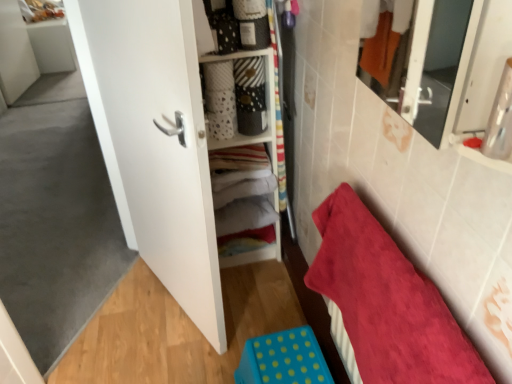
Question: Is red plush towel at lower right aimed at blue polka dot plastic step stool at lower center?

Choices:
 (A) no
 (B) yes

Answer: (B)

Question: Is red plush towel at lower right facing away from blue polka dot plastic step stool at lower center?

Choices:
 (A) no
 (B) yes

Answer: (A)

Question: Is red plush towel at lower right at the left side of blue polka dot plastic step stool at lower center?

Choices:
 (A) yes
 (B) no

Answer: (B)

Question: Is blue polka dot plastic step stool at lower center located within red plush towel at lower right?

Choices:
 (A) yes
 (B) no

Answer: (B)

Question: Does red plush towel at lower right have a greater height compared to blue polka dot plastic step stool at lower center?

Choices:
 (A) no
 (B) yes

Answer: (B)

Question: From a real-world perspective, is red plush towel at lower right physically above blue polka dot plastic step stool at lower center?

Choices:
 (A) no
 (B) yes

Answer: (B)

Question: Considering the relative positions of blue polka dot plastic step stool at lower center and matte white cabinet at center in the image provided, is blue polka dot plastic step stool at lower center behind matte white cabinet at center?

Choices:
 (A) yes
 (B) no

Answer: (B)

Question: Can you confirm if blue polka dot plastic step stool at lower center is positioned to the right of matte white cabinet at center?

Choices:
 (A) no
 (B) yes

Answer: (B)

Question: Is blue polka dot plastic step stool at lower center to the left of matte white cabinet at center from the viewer's perspective?

Choices:
 (A) yes
 (B) no

Answer: (B)

Question: Can we say blue polka dot plastic step stool at lower center lies outside matte white cabinet at center?

Choices:
 (A) no
 (B) yes

Answer: (B)

Question: Considering the relative sizes of blue polka dot plastic step stool at lower center and matte white cabinet at center in the image provided, is blue polka dot plastic step stool at lower center thinner than matte white cabinet at center?

Choices:
 (A) yes
 (B) no

Answer: (B)

Question: Is blue polka dot plastic step stool at lower center positioned with its back to matte white cabinet at center?

Choices:
 (A) no
 (B) yes

Answer: (A)

Question: From the image's perspective, is red plush towel at lower right over matte white cabinet at center?

Choices:
 (A) no
 (B) yes

Answer: (A)